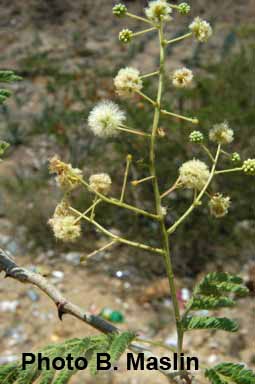
Where is `bottle`? This screenshot has width=255, height=384. bottle is located at coordinates [x=111, y=317].